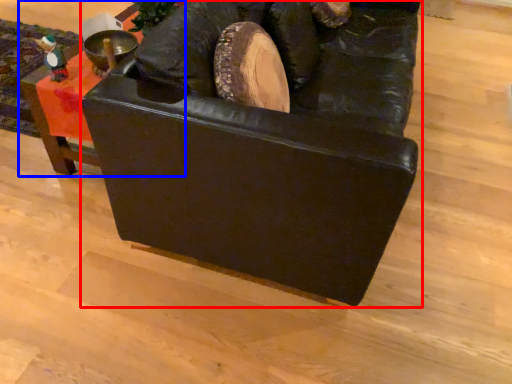
Question: Which of the following is the closest to the observer, furniture (highlighted by a red box) or furniture (highlighted by a blue box)?

Choices:
 (A) furniture
 (B) furniture

Answer: (A)